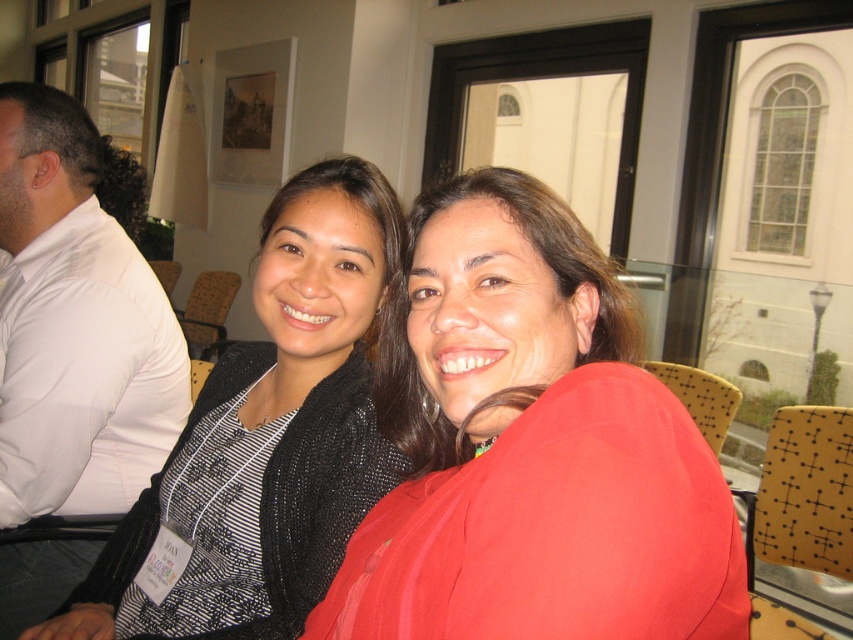
Question: Is black textured sweater at center above white shirt at left?

Choices:
 (A) yes
 (B) no

Answer: (B)

Question: Can you confirm if black textured sweater at center is positioned below white shirt at left?

Choices:
 (A) yes
 (B) no

Answer: (A)

Question: Which object is farther from the camera taking this photo?

Choices:
 (A) white shirt at left
 (B) matte black jacket at center
 (C) black textured sweater at center

Answer: (A)

Question: Which object is closer to the camera taking this photo?

Choices:
 (A) black textured sweater at center
 (B) white shirt at left
 (C) matte black jacket at center

Answer: (C)

Question: Is matte black jacket at center above black textured sweater at center?

Choices:
 (A) yes
 (B) no

Answer: (A)

Question: Which point is closer to the camera?

Choices:
 (A) (665, 429)
 (B) (262, 260)
 (C) (94, 413)

Answer: (A)